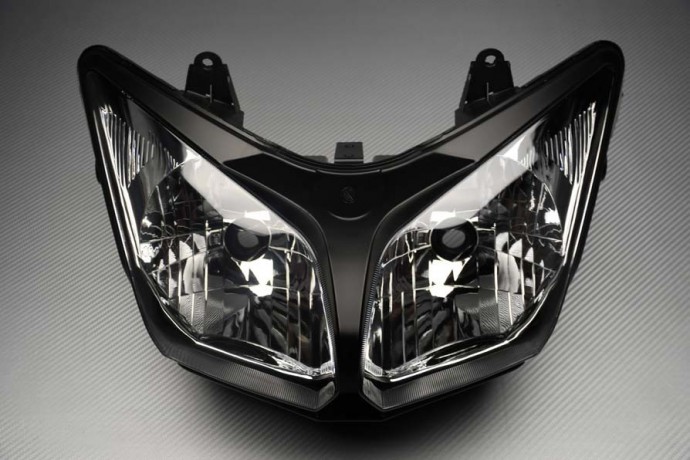
This screenshot has width=690, height=460. Find the location of `screw hole`. screw hole is located at coordinates (208, 63), (492, 60).